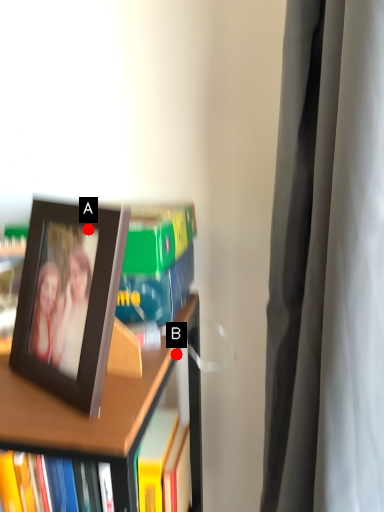
Question: Two points are circled on the image, labeled by A and B beside each circle. Among these points, which one is nearest to the camera?

Choices:
 (A) A is closer
 (B) B is closer

Answer: (A)